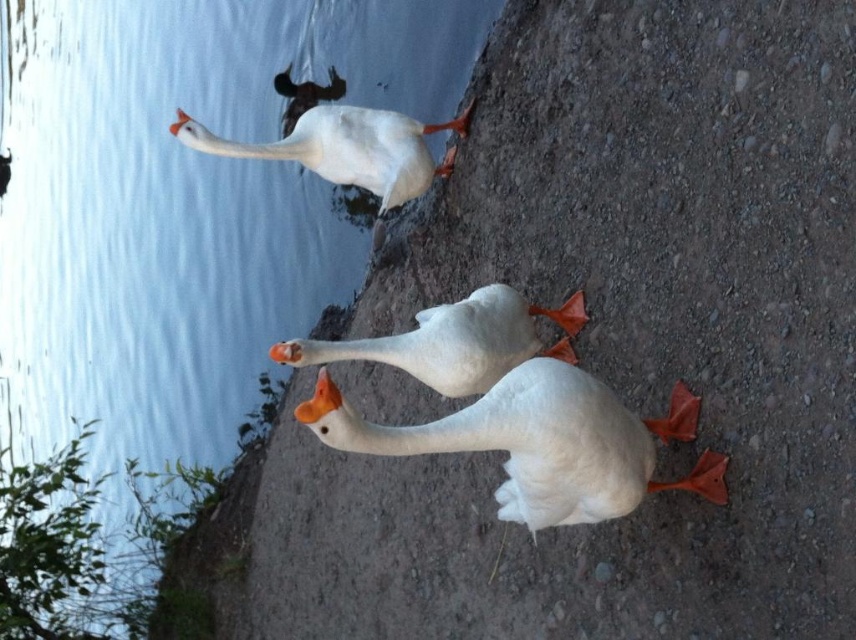
Which of these two, clear blue water at upper left or white matte goose at center, stands taller?

Standing taller between the two is clear blue water at upper left.

Between point (110, 141) and point (443, 428), which one is positioned behind?

Positioned behind is point (110, 141).

Is point (217, 170) more distant than point (554, 440)?

Yes, point (217, 170) is farther from viewer.

Where is `clear blue water at upper left`? This screenshot has width=856, height=640. clear blue water at upper left is located at coordinates (183, 204).

Is clear blue water at upper left behind white matte swan at center?

Yes, it is.

Who is lower down, clear blue water at upper left or white matte swan at center?

Positioned lower is white matte swan at center.

Image resolution: width=856 pixels, height=640 pixels. What do you see at coordinates (183, 204) in the screenshot? I see `clear blue water at upper left` at bounding box center [183, 204].

The width and height of the screenshot is (856, 640). What are the coordinates of `clear blue water at upper left` in the screenshot? It's located at (183, 204).

Can you confirm if white matte goose at center is bigger than white matte swan at center?

Yes, white matte goose at center is bigger than white matte swan at center.

Which is more to the right, white matte goose at center or white matte swan at center?

Positioned to the right is white matte goose at center.

Between point (625, 436) and point (496, 355), which one is positioned in front?

Point (625, 436)

Locate an element on the screen. Image resolution: width=856 pixels, height=640 pixels. white matte goose at center is located at coordinates (530, 444).